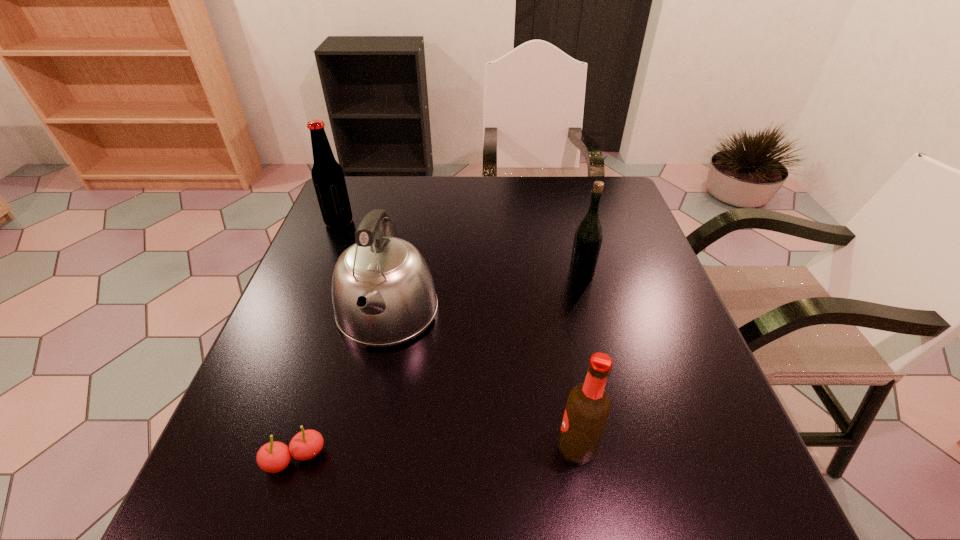
This screenshot has height=540, width=960. What are the coordinates of `free point between the cherry and the farthest object` in the screenshot? It's located at (317, 340).

At what (x,y) coordinates should I click in order to perform the action: click on vacant point located between the kettle and the nearest beer bottle. Please return your answer as a coordinate pair (x, y). Looking at the image, I should click on (482, 380).

The image size is (960, 540). I want to click on vacant area that lies between the second beer bottle from left to right and the shortest object, so click(436, 453).

This screenshot has width=960, height=540. Identify the location of vacant area between the cherry and the second object from right to left. (436, 453).

Image resolution: width=960 pixels, height=540 pixels. I want to click on unoccupied position between the second beer bottle from left to right and the farthest beer bottle, so click(458, 334).

Where is `vacant point located between the leftmost beer bottle and the rightmost beer bottle`? vacant point located between the leftmost beer bottle and the rightmost beer bottle is located at coordinates (460, 248).

You are a GUI agent. You are given a task and a screenshot of the screen. Output one action in this format:
    pyautogui.click(x=<x>, y=<y>)
    Task: Click on the vacant area that lies between the kettle and the rightmost object
    The width and height of the screenshot is (960, 540).
    Given the screenshot: What is the action you would take?
    pyautogui.click(x=484, y=294)

Locate an element on the screen. This screenshot has height=540, width=960. object that is the fourth closest one to the leftmost beer bottle is located at coordinates (588, 407).

Identify the location of object that is the third closest to the fourth object from left to right. (273, 457).

Find the location of a particular element. Image resolution: width=960 pixels, height=540 pixels. beer bottle that is the second nearest to the leftmost beer bottle is located at coordinates (x=588, y=407).